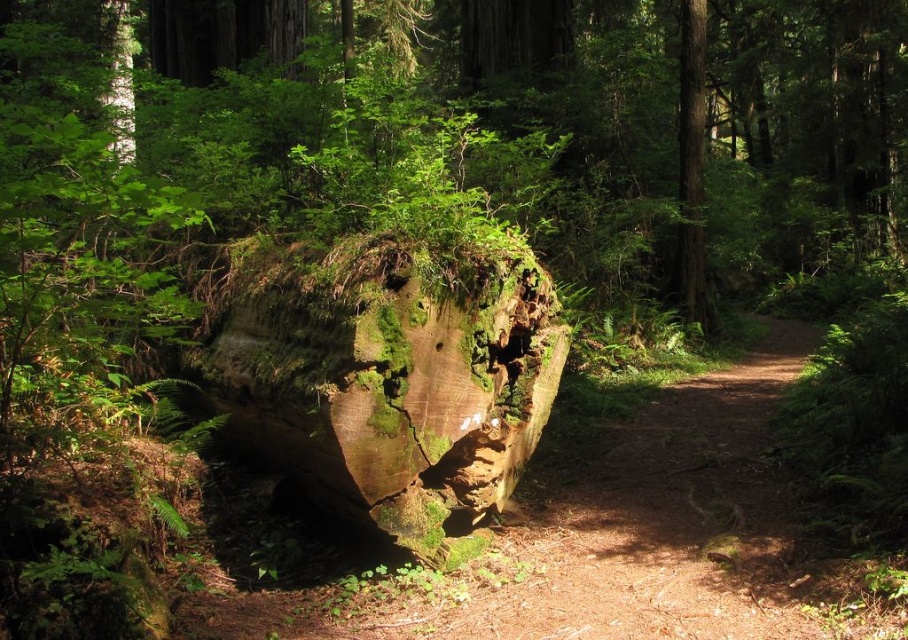
Can you confirm if green mossy wood at center is shorter than smooth brown tree trunk at center?

Yes, green mossy wood at center is shorter than smooth brown tree trunk at center.

Which is in front, point (393, 243) or point (704, 333)?

Point (393, 243) is in front.

Is point (323, 472) positioned after point (681, 184)?

No, it is not.

At what (x,y) coordinates should I click in order to perform the action: click on green mossy wood at center. Please return your answer as a coordinate pair (x, y). Image resolution: width=908 pixels, height=640 pixels. Looking at the image, I should click on (381, 378).